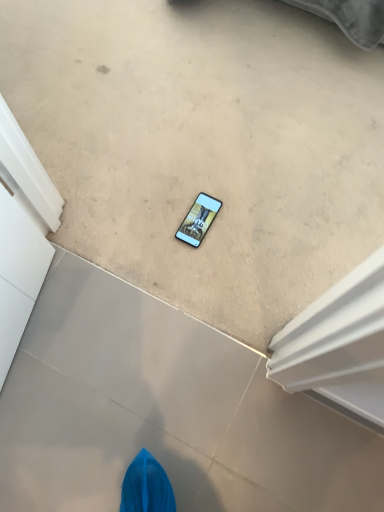
Locate an element on the screen. free space behind matte black phone at center is located at coordinates (200, 170).